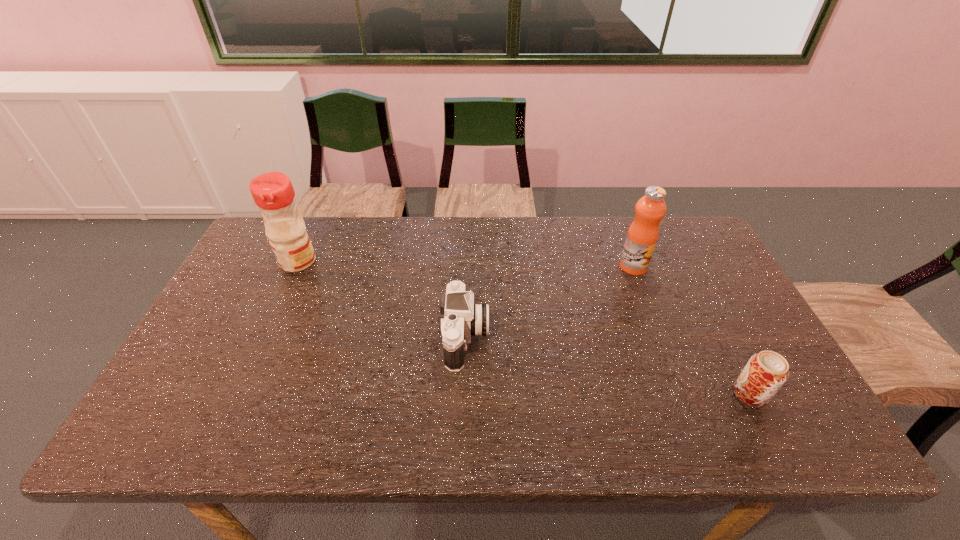
This screenshot has height=540, width=960. What are the coordinates of `blank region between the leftmost object and the rightmost object` in the screenshot? It's located at (524, 328).

Where is `empty location between the fruit juice and the leftmost object`? empty location between the fruit juice and the leftmost object is located at coordinates (466, 264).

The image size is (960, 540). What are the coordinates of `vacant space that is in between the condiment and the third farthest object` in the screenshot? It's located at (382, 300).

Where is `free area in between the beer can and the condiment`? free area in between the beer can and the condiment is located at coordinates (524, 328).

Locate an element on the screen. The width and height of the screenshot is (960, 540). free space that is in between the rightmost object and the second object from right to left is located at coordinates (691, 330).

I want to click on free space between the nearest object and the third object from left to right, so click(691, 330).

Identify the location of empty space between the beer can and the condiment. This screenshot has height=540, width=960. (524, 328).

This screenshot has width=960, height=540. In order to click on vacant point located between the fruit juice and the condiment in this screenshot , I will do `click(466, 264)`.

Find the location of a particular element. This screenshot has width=960, height=540. object that is the third closest to the condiment is located at coordinates [x=764, y=374].

Where is `the second closest object to the leftmost object`? the second closest object to the leftmost object is located at coordinates coord(643,233).